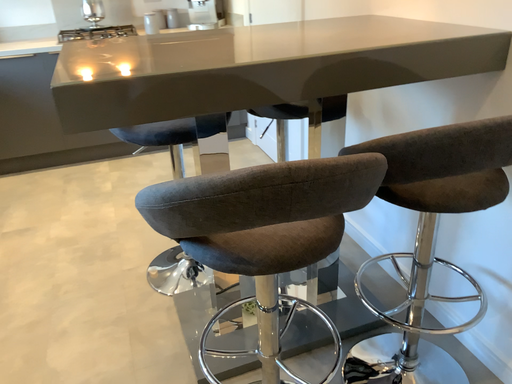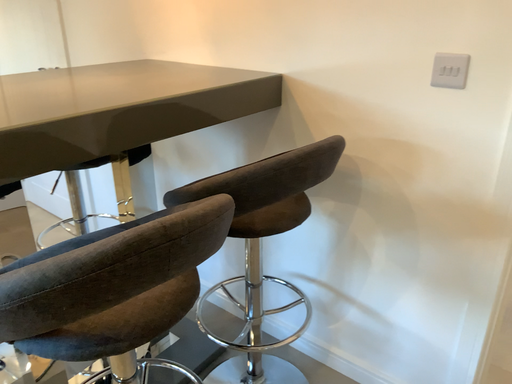
Question: How did the camera likely rotate when shooting the video?

Choices:
 (A) rotated right
 (B) rotated left

Answer: (A)